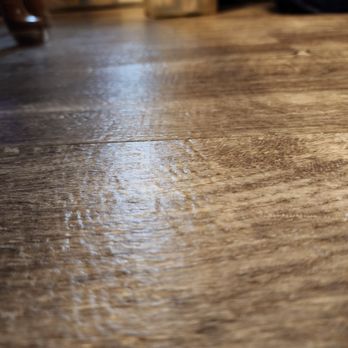
Identify the location of reflection of light on the floor. The width and height of the screenshot is (348, 348). (x=145, y=255), (x=143, y=186), (x=138, y=132), (x=138, y=70), (x=133, y=14).